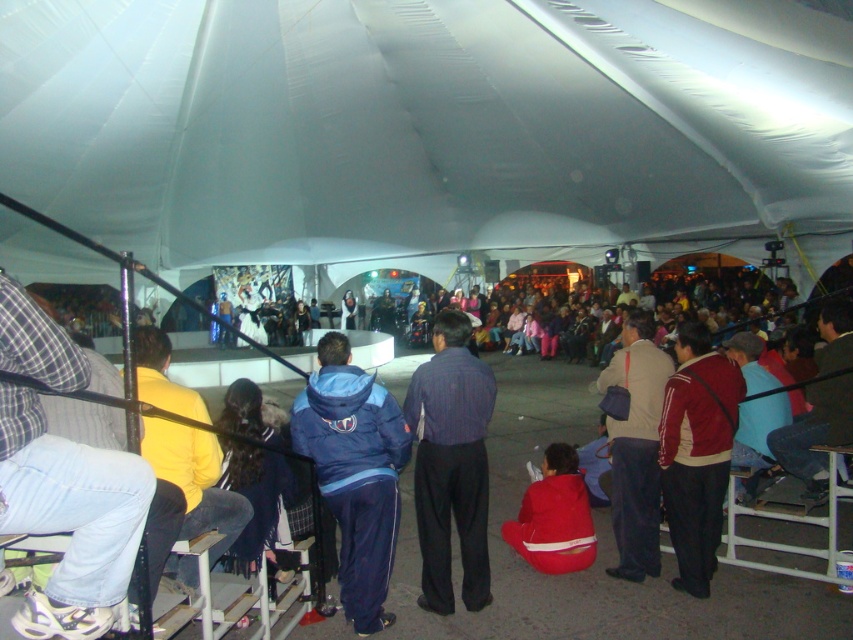
You are organizing a small event and need to place a 1.2 meter wide banner between the red jacket at center and the red fabric jacket at center. Can the space between them accommodate the banner?

The space between the red jacket at center and the red fabric jacket at center is wider than 1.2 meters, so the banner can be placed there.

You are an event organizer who needs to seat a VIP guest in a spot that allows them to see both the blue track suit at center and the red jacket at center clearly. Based on their positions, where should you place the guest?

The blue track suit at center is positioned on the left side of the red jacket at center. To ensure the VIP guest can see both clearly, they should be seated to the right of the red jacket at center so that the blue track suit at center is not blocked by the red jacket at center.